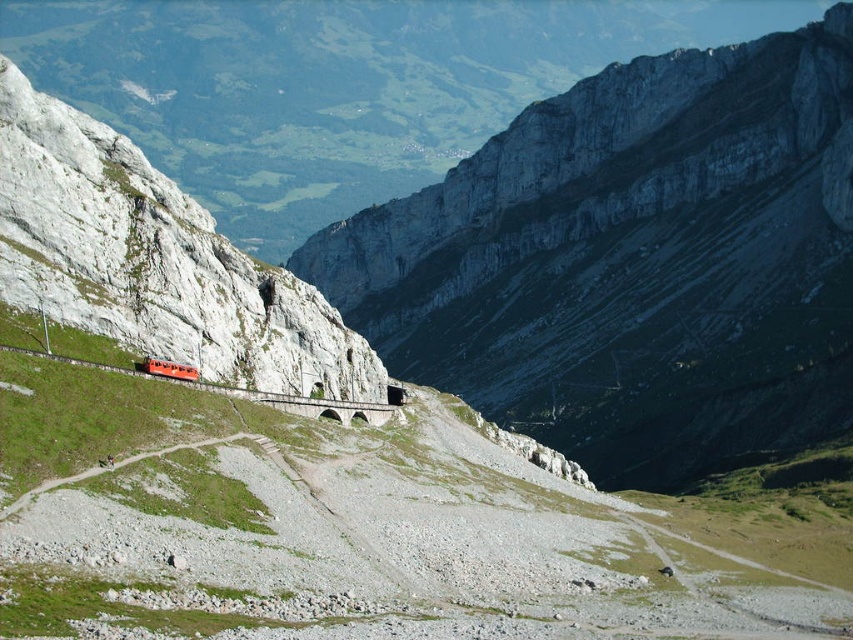
Does matte red train at left have a smaller size compared to matte orange train at center?

No, matte red train at left is not smaller than matte orange train at center.

Who is shorter, matte red train at left or matte orange train at center?

Standing shorter between the two is matte orange train at center.

Image resolution: width=853 pixels, height=640 pixels. Describe the element at coordinates (154, 260) in the screenshot. I see `matte red train at left` at that location.

Locate an element on the screen. matte red train at left is located at coordinates (154, 260).